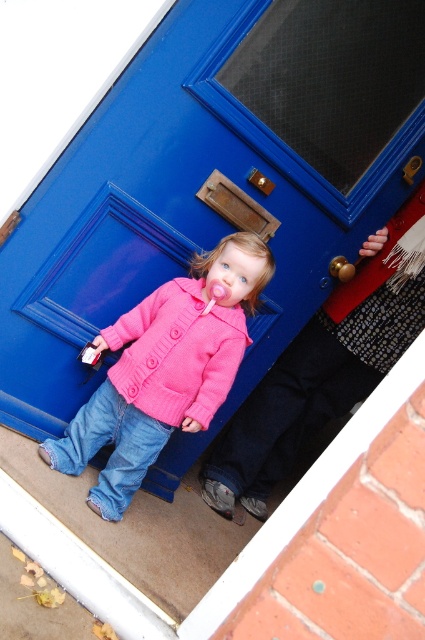
You are a delivery person trying to deliver a package to the house. The package can only be given to someone who is not behind the blue matte door at center. Based on the scene, can you safely give the package to the person in the pink knitted jacket at lower left?

The blue matte door at center is in front of the pink knitted jacket at lower left, meaning the pink knitted jacket at lower left is behind the door. Therefore, you cannot safely give the package to them as they are behind the door.